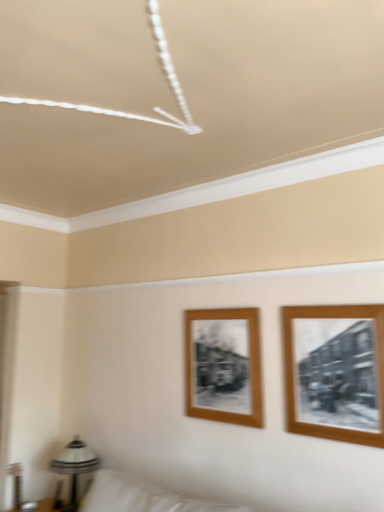
Question: From the image's perspective, is wooden framed photo at right, which is counted as the second picture frame, starting from the left, located beneath wooden frame at center, positioned as the 2th picture frame in front-to-back order?

Choices:
 (A) yes
 (B) no

Answer: (B)

Question: Is wooden framed photo at right, positioned as the first picture frame in right-to-left order, looking in the opposite direction of wooden frame at center, marked as the 2th picture frame in a right-to-left arrangement?

Choices:
 (A) yes
 (B) no

Answer: (B)

Question: Considering the relative sizes of wooden framed photo at right, the 2th picture frame from the back, and wooden frame at center, positioned as the 2th picture frame in front-to-back order, in the image provided, is wooden framed photo at right, the 2th picture frame from the back, smaller than wooden frame at center, positioned as the 2th picture frame in front-to-back order,?

Choices:
 (A) no
 (B) yes

Answer: (A)

Question: Can you confirm if wooden framed photo at right, positioned as the first picture frame in right-to-left order, is positioned to the left of wooden frame at center, which ranks as the 1th picture frame in left-to-right order?

Choices:
 (A) yes
 (B) no

Answer: (B)

Question: Considering the relative sizes of wooden framed photo at right, the 2th picture frame from the back, and wooden frame at center, positioned as the 2th picture frame in front-to-back order, in the image provided, is wooden framed photo at right, the 2th picture frame from the back, wider than wooden frame at center, positioned as the 2th picture frame in front-to-back order,?

Choices:
 (A) no
 (B) yes

Answer: (B)

Question: Is wooden frame at center, positioned as the 2th picture frame in front-to-back order, situated inside metallic silver table lamp at lower left or outside?

Choices:
 (A) outside
 (B) inside

Answer: (A)

Question: From the image's perspective, is wooden frame at center, which is counted as the first picture frame, starting from the back, above or below metallic silver table lamp at lower left?

Choices:
 (A) below
 (B) above

Answer: (B)

Question: In terms of width, does wooden frame at center, which is counted as the first picture frame, starting from the back, look wider or thinner when compared to metallic silver table lamp at lower left?

Choices:
 (A) thin
 (B) wide

Answer: (A)

Question: In terms of size, does wooden frame at center, which ranks as the 1th picture frame in left-to-right order, appear bigger or smaller than metallic silver table lamp at lower left?

Choices:
 (A) small
 (B) big

Answer: (A)

Question: Considering the positions of wooden framed photo at right, which is the first picture frame from front to back, and wooden frame at center, marked as the 2th picture frame in a right-to-left arrangement, in the image, is wooden framed photo at right, which is the first picture frame from front to back, wider or thinner than wooden frame at center, marked as the 2th picture frame in a right-to-left arrangement,?

Choices:
 (A) wide
 (B) thin

Answer: (A)

Question: From a real-world perspective, is wooden framed photo at right, the 2th picture frame from the back, above or below wooden frame at center, which is counted as the first picture frame, starting from the back?

Choices:
 (A) above
 (B) below

Answer: (A)

Question: Considering the positions of wooden framed photo at right, the 2th picture frame from the back, and wooden frame at center, which is counted as the first picture frame, starting from the back, in the image, is wooden framed photo at right, the 2th picture frame from the back, taller or shorter than wooden frame at center, which is counted as the first picture frame, starting from the back,?

Choices:
 (A) tall
 (B) short

Answer: (A)

Question: Based on their sizes in the image, would you say wooden framed photo at right, which is the first picture frame from front to back, is bigger or smaller than wooden frame at center, which ranks as the 1th picture frame in left-to-right order?

Choices:
 (A) small
 (B) big

Answer: (B)

Question: In terms of width, does metallic silver table lamp at lower left look wider or thinner when compared to wooden framed photo at right, the 2th picture frame from the back?

Choices:
 (A) thin
 (B) wide

Answer: (B)

Question: From the image's perspective, is metallic silver table lamp at lower left above or below wooden framed photo at right, the 2th picture frame from the back?

Choices:
 (A) below
 (B) above

Answer: (A)